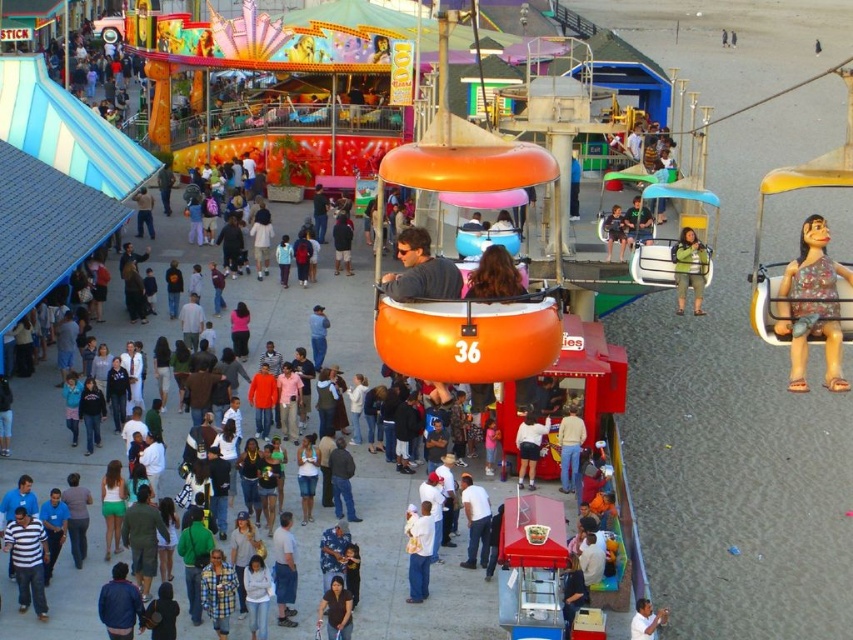
You are a photographer at the fair and want to take a photo of the white cotton shirt at center and denim jacket at center. Which one is blocking the other from view?

The white cotton shirt at center is in front of the denim jacket at center, so it is blocking the denim jacket at center from view.